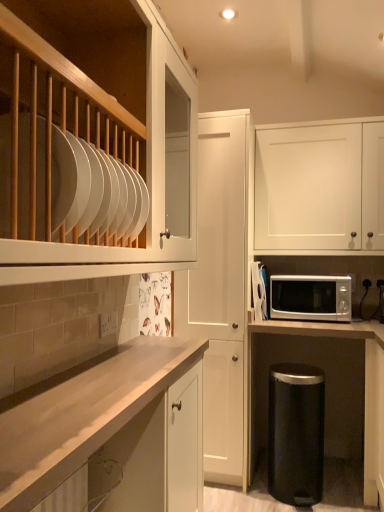
Question: Is silver metallic microwave at lower right inside white matte cabinet at center, which is counted as the 2th cabinetry, starting from the left?

Choices:
 (A) yes
 (B) no

Answer: (B)

Question: From the image's perspective, is white matte cabinet at center, the second cabinetry when ordered from front to back, under silver metallic microwave at lower right?

Choices:
 (A) yes
 (B) no

Answer: (B)

Question: Considering the relative sizes of white matte cabinet at center, which is the 2th cabinetry from right to left, and silver metallic microwave at lower right in the image provided, is white matte cabinet at center, which is the 2th cabinetry from right to left, bigger than silver metallic microwave at lower right?

Choices:
 (A) no
 (B) yes

Answer: (B)

Question: Is white matte cabinet at center, which is the 2th cabinetry from right to left, completely or partially outside of silver metallic microwave at lower right?

Choices:
 (A) no
 (B) yes

Answer: (B)

Question: Is white matte cabinet at center, which is the 2th cabinetry from right to left, behind silver metallic microwave at lower right?

Choices:
 (A) yes
 (B) no

Answer: (B)

Question: Considering their positions, is white matte cabinet at upper right, acting as the 1th cabinetry starting from the right, located in front of or behind white matte cabinet at center, which is counted as the 2th cabinetry, starting from the left?

Choices:
 (A) front
 (B) behind

Answer: (B)

Question: Is white matte cabinet at upper right, acting as the 1th cabinetry starting from the right, inside the boundaries of white matte cabinet at center, which is counted as the 2th cabinetry, starting from the left, or outside?

Choices:
 (A) inside
 (B) outside

Answer: (B)

Question: Considering the positions of white matte cabinet at upper right, acting as the 1th cabinetry starting from the right, and white matte cabinet at center, which is the 2th cabinetry from right to left, in the image, is white matte cabinet at upper right, acting as the 1th cabinetry starting from the right, wider or thinner than white matte cabinet at center, which is the 2th cabinetry from right to left,?

Choices:
 (A) wide
 (B) thin

Answer: (B)

Question: Considering the positions of white matte cabinet at upper right, the first cabinetry positioned from the back, and white matte cabinet at center, which is the 2th cabinetry from right to left, in the image, is white matte cabinet at upper right, the first cabinetry positioned from the back, taller or shorter than white matte cabinet at center, which is the 2th cabinetry from right to left,?

Choices:
 (A) short
 (B) tall

Answer: (A)

Question: Relative to silver metallic microwave at lower right, is white matte cabinet at center, which is counted as the 2th cabinetry, starting from the left, in front or behind?

Choices:
 (A) behind
 (B) front

Answer: (B)

Question: Is point (223, 351) closer or farther from the camera than point (281, 287)?

Choices:
 (A) farther
 (B) closer

Answer: (B)

Question: Would you say white matte cabinet at center, which is the 2th cabinetry from right to left, is inside or outside silver metallic microwave at lower right?

Choices:
 (A) inside
 (B) outside

Answer: (B)

Question: Visually, is white matte cabinet at center, the second cabinetry when ordered from front to back, positioned to the left or to the right of silver metallic microwave at lower right?

Choices:
 (A) right
 (B) left

Answer: (B)

Question: Would you say black matte trash can at lower right is to the left or to the right of light wood countertop at center, marked as the 3th cabinetry in a back-to-front arrangement, in the picture?

Choices:
 (A) right
 (B) left

Answer: (A)

Question: Is black matte trash can at lower right in front of or behind light wood countertop at center, positioned as the 1th cabinetry in left-to-right order, in the image?

Choices:
 (A) front
 (B) behind

Answer: (B)